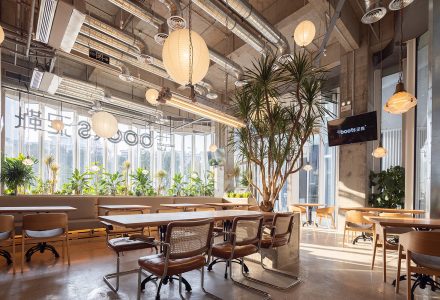
In order to click on tables in this screenshot , I will do `click(66, 206)`, `click(123, 206)`, `click(182, 205)`, `click(226, 202)`, `click(220, 214)`, `click(310, 205)`, `click(381, 210)`, `click(407, 221)`.